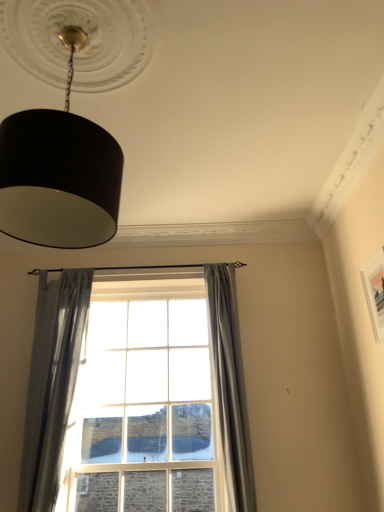
Question: From a real-world perspective, is gray fabric curtain at center, placed as the first curtain when sorted from right to left, under clear glass window at center?

Choices:
 (A) no
 (B) yes

Answer: (A)

Question: Is gray fabric curtain at center, which is the second curtain in left-to-right order, to the right of clear glass window at center from the viewer's perspective?

Choices:
 (A) no
 (B) yes

Answer: (B)

Question: From a real-world perspective, is gray fabric curtain at center, placed as the first curtain when sorted from right to left, positioned over clear glass window at center based on gravity?

Choices:
 (A) no
 (B) yes

Answer: (B)

Question: Could clear glass window at center be considered to be inside gray fabric curtain at center, placed as the first curtain when sorted from right to left?

Choices:
 (A) yes
 (B) no

Answer: (B)

Question: Could you tell me if gray fabric curtain at center, placed as the first curtain when sorted from right to left, is facing clear glass window at center?

Choices:
 (A) no
 (B) yes

Answer: (A)

Question: Is gray fabric curtain at center, which is the second curtain in left-to-right order, further to camera compared to clear glass window at center?

Choices:
 (A) no
 (B) yes

Answer: (A)

Question: Is gray fabric curtain at center, placed as the first curtain when sorted from right to left, positioned far away from black matte lampshade at upper left?

Choices:
 (A) no
 (B) yes

Answer: (B)

Question: From a real-world perspective, is gray fabric curtain at center, which is the second curtain in left-to-right order, on top of black matte lampshade at upper left?

Choices:
 (A) yes
 (B) no

Answer: (B)

Question: Is gray fabric curtain at center, placed as the first curtain when sorted from right to left, with black matte lampshade at upper left?

Choices:
 (A) yes
 (B) no

Answer: (B)

Question: Is gray fabric curtain at center, which is the second curtain in left-to-right order, oriented towards black matte lampshade at upper left?

Choices:
 (A) yes
 (B) no

Answer: (B)

Question: Is gray fabric curtain at center, which is the second curtain in left-to-right order, surrounding black matte lampshade at upper left?

Choices:
 (A) yes
 (B) no

Answer: (B)

Question: From a real-world perspective, does gray fabric curtain at center, placed as the first curtain when sorted from right to left, sit lower than black matte lampshade at upper left?

Choices:
 (A) yes
 (B) no

Answer: (A)

Question: Is black matte lampshade at upper left outside gray sheer curtain at left, the 1th curtain positioned from the left?

Choices:
 (A) yes
 (B) no

Answer: (A)